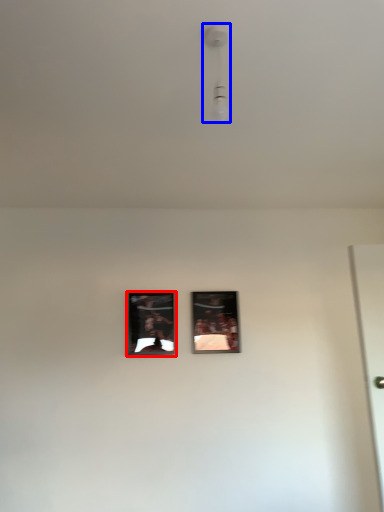
Question: Which of the following is the closest to the observer, picture frame (highlighted by a red box) or light fixture (highlighted by a blue box)?

Choices:
 (A) picture frame
 (B) light fixture

Answer: (B)